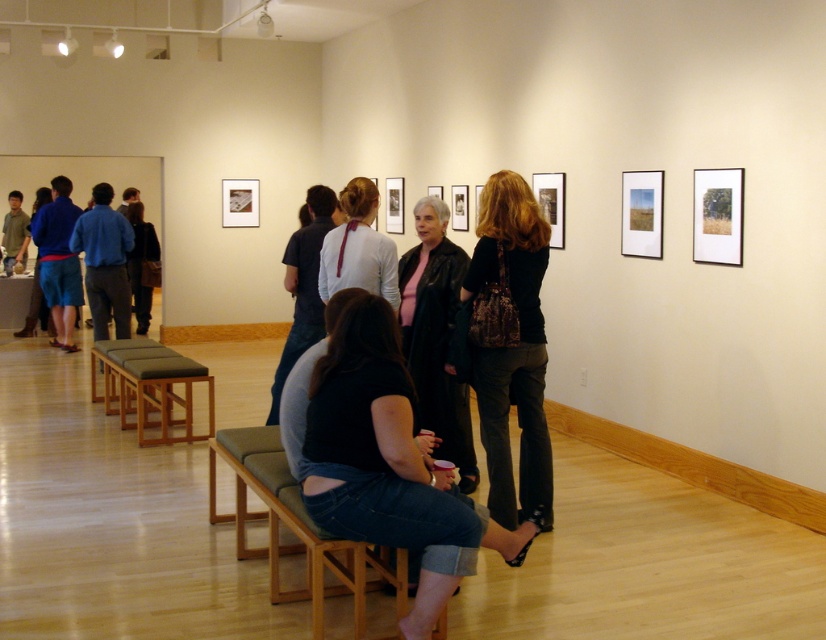
You are standing at the entrance of the gallery. There are two points marked in the image. The first point is at coordinate point (x=428, y=264) and the second point is at coordinate point (x=140, y=362). Which point is closer to you?

Point (x=428, y=264) is in front of point (x=140, y=362), so the first point is closer to you.